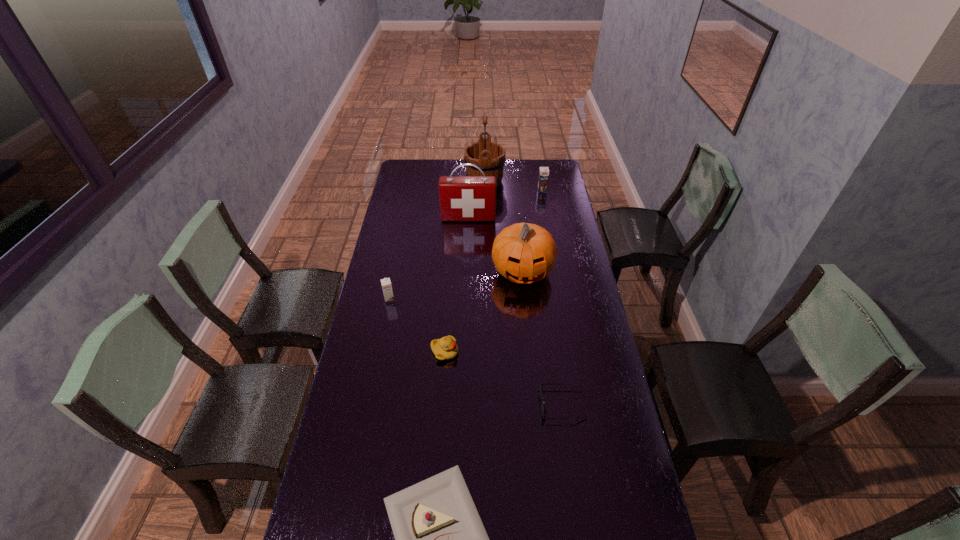
The height and width of the screenshot is (540, 960). I want to click on the tallest object, so click(489, 156).

The width and height of the screenshot is (960, 540). I want to click on the sixth nearest object, so click(462, 198).

Image resolution: width=960 pixels, height=540 pixels. Find the location of `the fifth nearest object`. the fifth nearest object is located at coordinates (524, 253).

This screenshot has height=540, width=960. I want to click on the sixth shortest object, so click(x=524, y=253).

This screenshot has height=540, width=960. I want to click on the fourth tallest object, so click(543, 171).

Find the location of a particular element. This screenshot has width=960, height=540. the right chocolate milk is located at coordinates (543, 171).

This screenshot has height=540, width=960. Identify the location of the fourth nearest object. (386, 283).

Find the location of a particular element. The width and height of the screenshot is (960, 540). the fourth shortest object is located at coordinates (386, 283).

The width and height of the screenshot is (960, 540). In order to click on the sixth farthest object in this screenshot , I will do `click(445, 348)`.

The image size is (960, 540). I want to click on the shortest object, so click(544, 411).